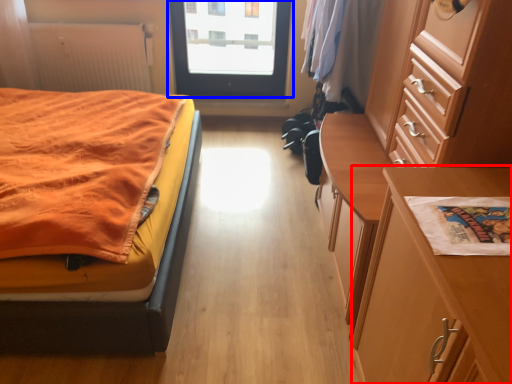
Question: Among these objects, which one is farthest to the camera, table (highlighted by a red box) or door (highlighted by a blue box)?

Choices:
 (A) table
 (B) door

Answer: (B)